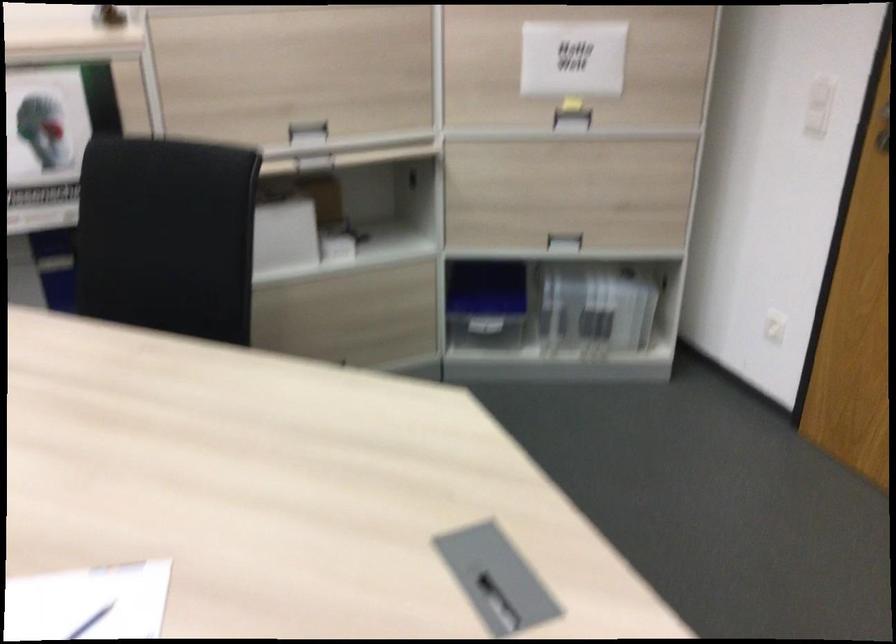
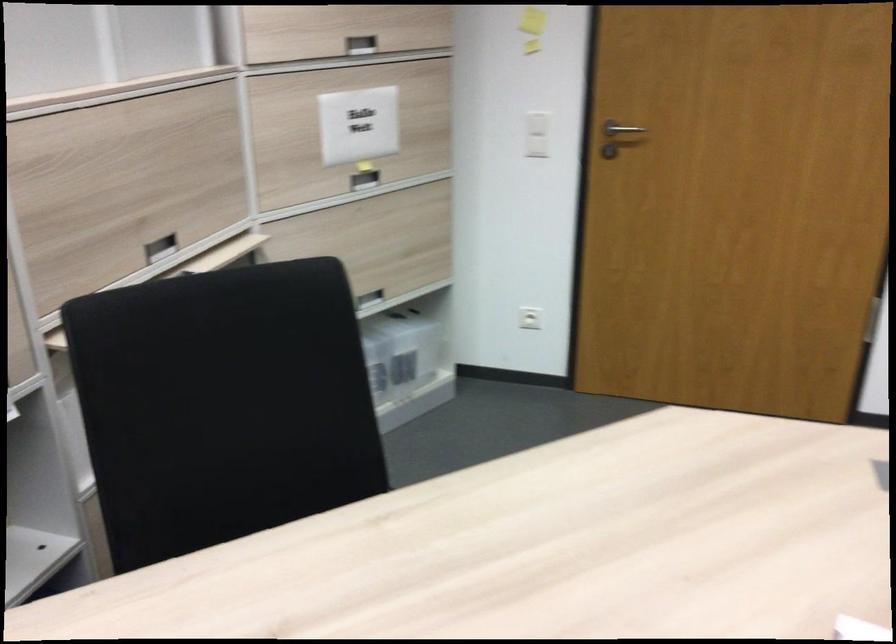
Locate, in the second image, the point that corresponds to point 556,240 in the first image.

(368, 299)